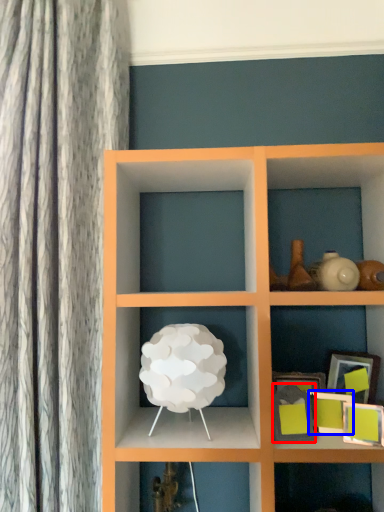
Question: Which of the following is the closest to the observer, picture frame (highlighted by a red box) or picture frame (highlighted by a blue box)?

Choices:
 (A) picture frame
 (B) picture frame

Answer: (A)